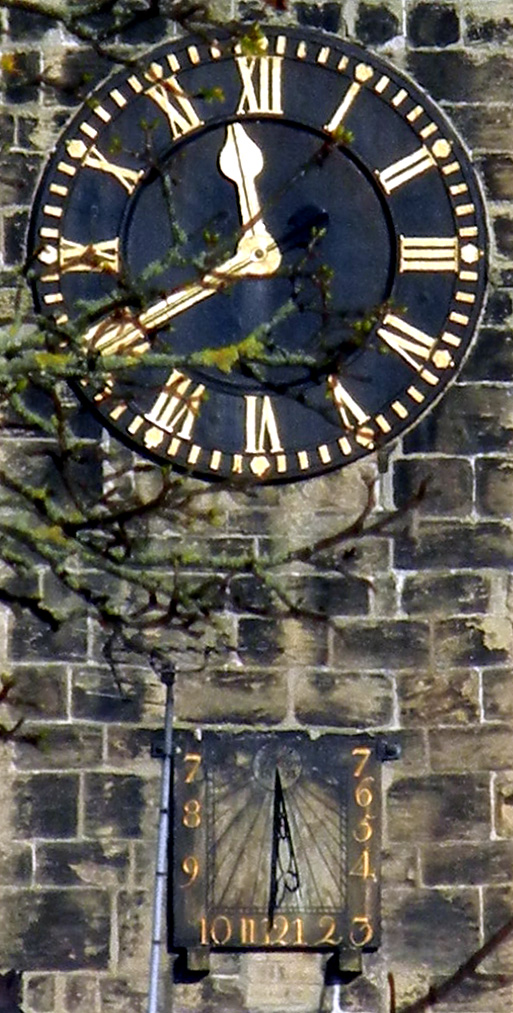
You are a GUI agent. You are given a task and a screenshot of the screen. Output one action in this format:
    pyautogui.click(x=<x>, y=<y>)
    Task: Click on the clock
    
    Given the screenshot: What is the action you would take?
    pyautogui.click(x=218, y=168), pyautogui.click(x=166, y=380), pyautogui.click(x=363, y=312), pyautogui.click(x=360, y=153), pyautogui.click(x=307, y=66)